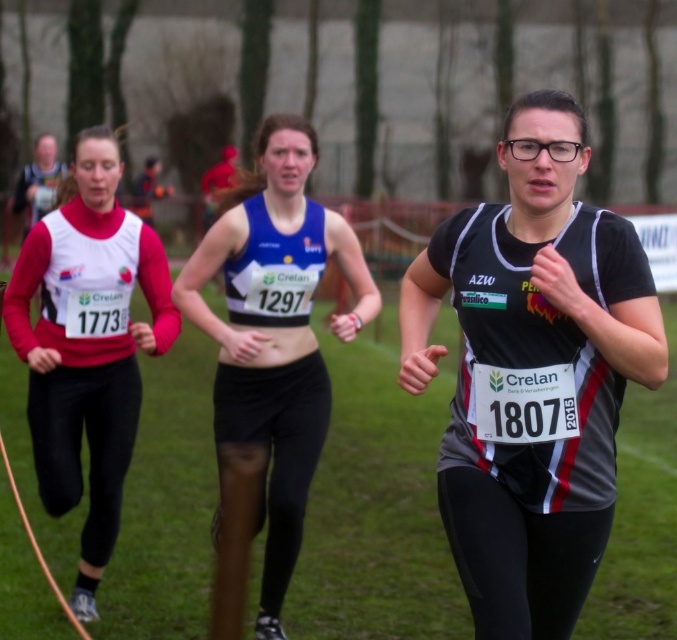
Between blue fabric top at center and matte white vest at left, which one is positioned lower?

blue fabric top at center is below.

Does blue fabric top at center appear on the left side of matte white vest at left?

In fact, blue fabric top at center is to the right of matte white vest at left.

You are a GUI agent. You are given a task and a screenshot of the screen. Output one action in this format:
    pyautogui.click(x=<x>, y=<y>)
    Task: Click on the blue fabric top at center
    
    Given the screenshot: What is the action you would take?
    pyautogui.click(x=269, y=358)

The width and height of the screenshot is (677, 640). Find the location of `black matte running suit at center`. black matte running suit at center is located at coordinates coord(531,372).

Based on the photo, is black matte running suit at center closer to the viewer compared to matte black bib at left?

That is True.

What do you see at coordinates (531, 372) in the screenshot?
I see `black matte running suit at center` at bounding box center [531, 372].

Identify the location of black matte running suit at center. Image resolution: width=677 pixels, height=640 pixels. (531, 372).

Based on the photo, which of these two, blue fabric top at center or matte black bib at left, stands taller?

blue fabric top at center

Does blue fabric top at center come behind matte black bib at left?

No, blue fabric top at center is closer to the viewer.

Between point (313, 278) and point (30, 221), which one is positioned in front?

Point (313, 278) is in front.

Locate an element on the screen. The image size is (677, 640). blue fabric top at center is located at coordinates (269, 358).